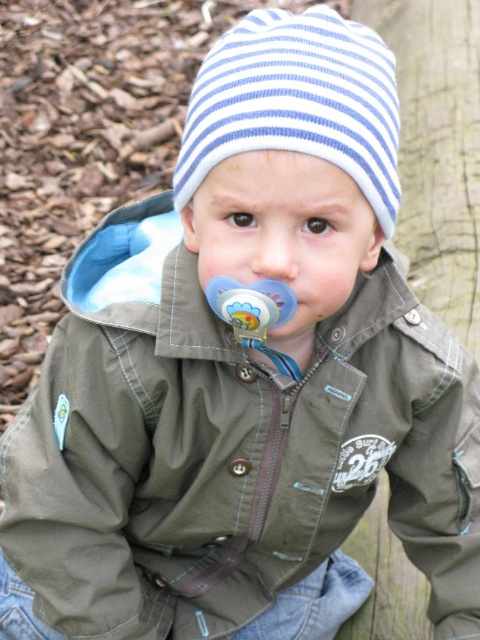
Question: Estimate the real-world distances between objects in this image. Which object is closer to the smooth skin nose at center?

Choices:
 (A) blue rubber pacifier at center
 (B) blue striped knit hat at upper center

Answer: (A)

Question: Can you confirm if blue striped knit hat at upper center is wider than smooth skin nose at center?

Choices:
 (A) yes
 (B) no

Answer: (A)

Question: Which object is closer to the camera taking this photo?

Choices:
 (A) blue rubber pacifier at center
 (B) blue striped knit hat at upper center
 (C) smooth skin nose at center

Answer: (B)

Question: Does blue rubber pacifier at center have a greater width compared to smooth skin nose at center?

Choices:
 (A) yes
 (B) no

Answer: (A)

Question: Is blue striped knit hat at upper center to the right of smooth skin nose at center from the viewer's perspective?

Choices:
 (A) yes
 (B) no

Answer: (A)

Question: Which object is positioned closest to the blue rubber pacifier at center?

Choices:
 (A) smooth skin nose at center
 (B) blue striped knit hat at upper center

Answer: (A)